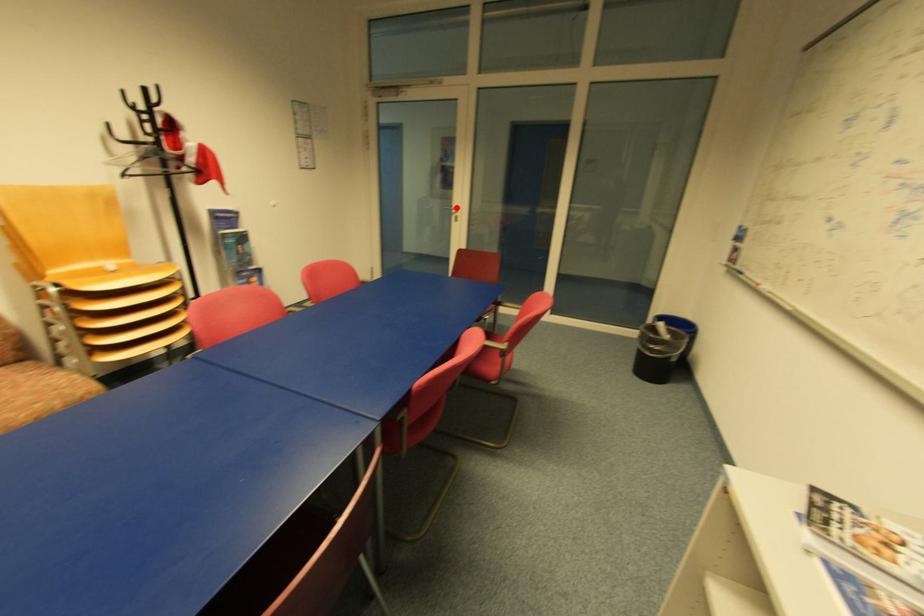
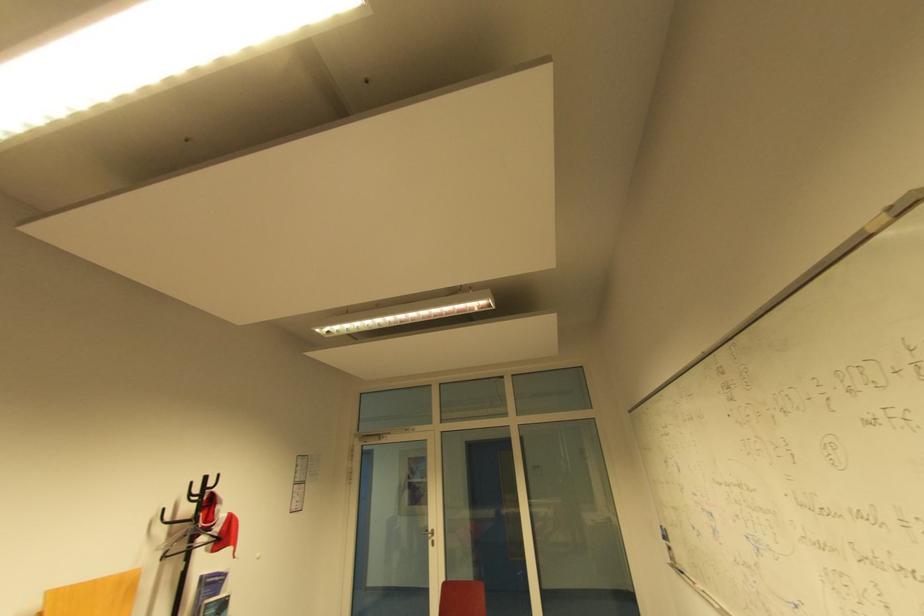
Where in the second image is the point corresponding to the highlighted location from the first image?

(434, 531)